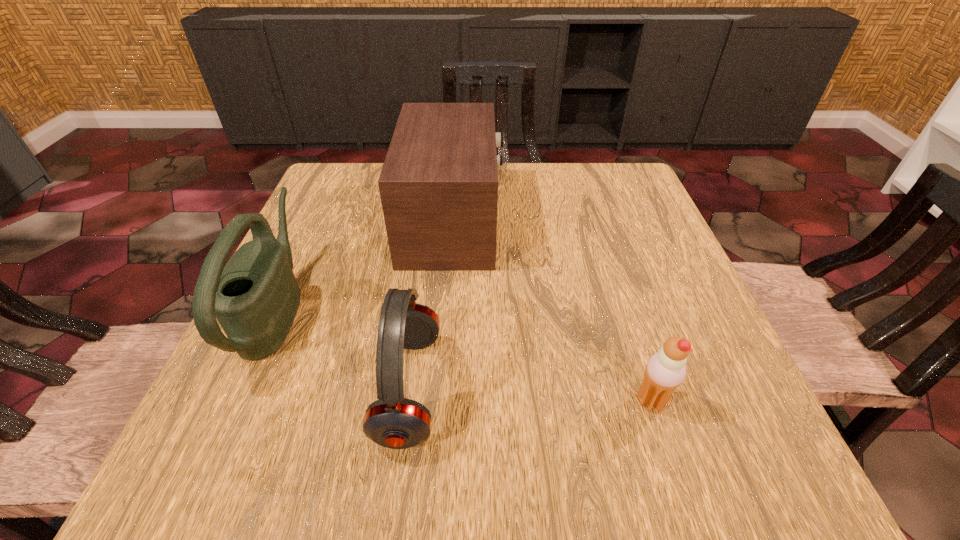
I want to click on vacant area that lies between the earphone and the icecream, so click(x=530, y=395).

Identify which object is the nearest to the earphone. Please provide its 2D coordinates. Your answer should be formatted as a tuple, i.e. [(x, y)], where the tuple contains the x and y coordinates of a point satisfying the conditions above.

[(438, 185)]

You are a GUI agent. You are given a task and a screenshot of the screen. Output one action in this format:
    pyautogui.click(x=<x>, y=<y>)
    Task: Click on the object that is the third closest to the radio receiver
    This screenshot has height=540, width=960.
    Given the screenshot: What is the action you would take?
    pyautogui.click(x=664, y=372)